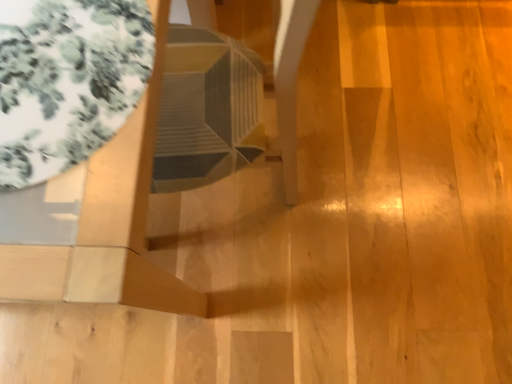
Question: Could matte wood side table at upper left be considered to be inside transparent glass table at upper left?

Choices:
 (A) yes
 (B) no

Answer: (B)

Question: Can you confirm if transparent glass table at upper left is positioned to the right of matte wood side table at upper left?

Choices:
 (A) no
 (B) yes

Answer: (B)

Question: Can you confirm if transparent glass table at upper left is positioned to the left of matte wood side table at upper left?

Choices:
 (A) yes
 (B) no

Answer: (B)

Question: Is matte wood side table at upper left at the back of transparent glass table at upper left?

Choices:
 (A) yes
 (B) no

Answer: (A)

Question: Does transparent glass table at upper left have a greater height compared to matte wood side table at upper left?

Choices:
 (A) yes
 (B) no

Answer: (B)

Question: From a real-world perspective, is transparent glass table at upper left located higher than matte wood side table at upper left?

Choices:
 (A) yes
 (B) no

Answer: (A)

Question: Can you confirm if matte wood side table at upper left is bigger than transparent glass table at upper left?

Choices:
 (A) yes
 (B) no

Answer: (A)

Question: From the image's perspective, is matte wood side table at upper left below transparent glass table at upper left?

Choices:
 (A) yes
 (B) no

Answer: (A)

Question: Is matte wood side table at upper left closer to camera compared to transparent glass table at upper left?

Choices:
 (A) no
 (B) yes

Answer: (B)

Question: Is transparent glass table at upper left located within matte wood side table at upper left?

Choices:
 (A) yes
 (B) no

Answer: (A)

Question: Is matte wood side table at upper left smaller than transparent glass table at upper left?

Choices:
 (A) no
 (B) yes

Answer: (A)

Question: Can you confirm if matte wood side table at upper left is positioned to the right of transparent glass table at upper left?

Choices:
 (A) no
 (B) yes

Answer: (A)

Question: In terms of height, does transparent glass table at upper left look taller or shorter compared to matte wood side table at upper left?

Choices:
 (A) short
 (B) tall

Answer: (A)